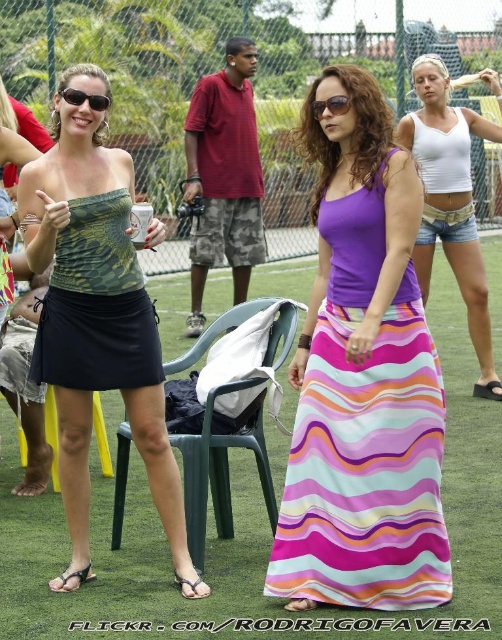
Question: Among these points, which one is nearest to the camera?

Choices:
 (A) (62, 317)
 (B) (339, 100)
 (C) (439, 371)

Answer: (B)

Question: Is green grass at center above camouflage fabric skirt at center?

Choices:
 (A) yes
 (B) no

Answer: (B)

Question: Which object is farther from the camera taking this photo?

Choices:
 (A) multicolored striped skirt at center
 (B) matte green tube top at left
 (C) sunglasses at center

Answer: (C)

Question: Observing the image, what is the correct spatial positioning of matte black sunglasses at upper left in reference to sunglasses at center?

Choices:
 (A) above
 (B) below

Answer: (A)

Question: Which of the following is the closest to the observer?

Choices:
 (A) multicolored striped skirt at center
 (B) matte green tube top at left
 (C) sunglasses at center

Answer: (B)

Question: Does camouflage fabric skirt at center have a lesser width compared to matte black sunglasses at upper left?

Choices:
 (A) yes
 (B) no

Answer: (B)